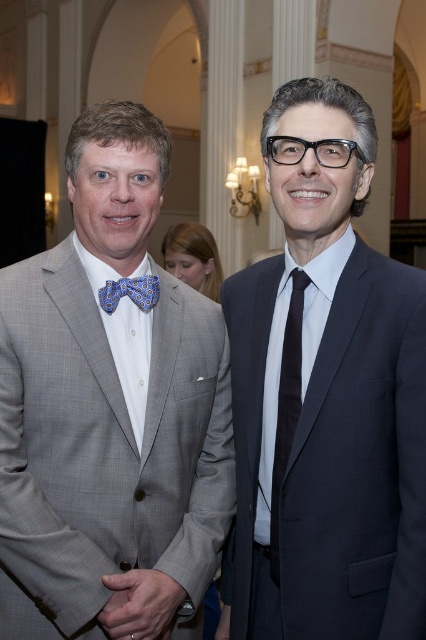
The width and height of the screenshot is (426, 640). What do you see at coordinates (109, 412) in the screenshot? I see `gray textured suit at left` at bounding box center [109, 412].

Who is more distant from viewer, [134,540] or [304,496]?

The point [134,540] is behind.

This screenshot has width=426, height=640. In order to click on gray textured suit at left in this screenshot , I will do `click(109, 412)`.

At what (x,y) coordinates should I click in order to perform the action: click on gray textured suit at left. Please return your answer as a coordinate pair (x, y). Image resolution: width=426 pixels, height=640 pixels. Looking at the image, I should click on (109, 412).

Is black silk tie at center further to camera compared to blue patterned bow tie at left?

No.

From the picture: Is black silk tie at center taller than blue patterned bow tie at left?

Yes.

Between point (279, 433) and point (131, 298), which one is positioned behind?

Point (131, 298)

Identify the location of black silk tie at center. Image resolution: width=426 pixels, height=640 pixels. (287, 408).

Which is below, satin black suit at center or blue patterned bow tie at left?

satin black suit at center is lower down.

Based on the photo, can you confirm if satin black suit at center is taller than blue patterned bow tie at left?

Correct, satin black suit at center is much taller as blue patterned bow tie at left.

Which is in front, point (296, 145) or point (132, 291)?

Point (296, 145)

Identify the location of satin black suit at center. (325, 396).